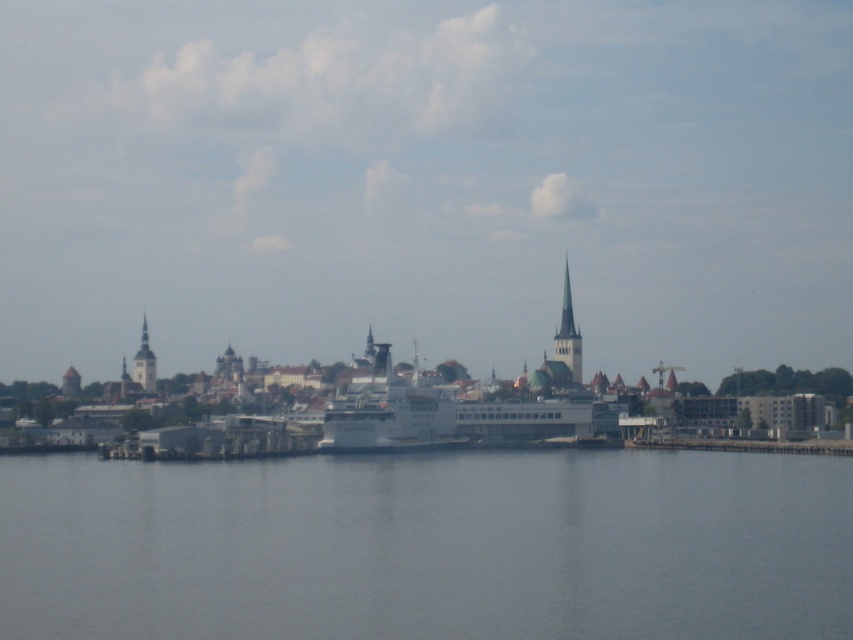
You are a drone operator tasked with flying a drone from the green stone spire at center to the cruise ship docked at the pier. The drone has a maximum range of 300 meters. Can you safely complete the flight without needing to recharge?

The distance between the green stone spire at center and the cruise ship docked at the pier is 293.23 meters, which is within the drone operator maximum range of 300 meters. The drone can safely complete the flight without needing to recharge.

You are a tour guide on a boat near the waterfront scene. You need to inform your passengers about the distance between the gray water at center and the white matte ship at center. What do you tell them?

The gray water at center and the white matte ship at center are 136.49 feet apart.

You are a tour guide giving a virtual tour of the waterfront. You mention the white matte ship at center and ask your audience to estimate its position relative to the pier. Based on the coordinates provided, can they determine if the ship is closer to the left or right side of the pier?

The white matte ship at center is located at point coordinates 0.644 on the x and 0.455 on the y. Since the x coordinate is closer to 1, the ship is positioned more to the right side of the pier.